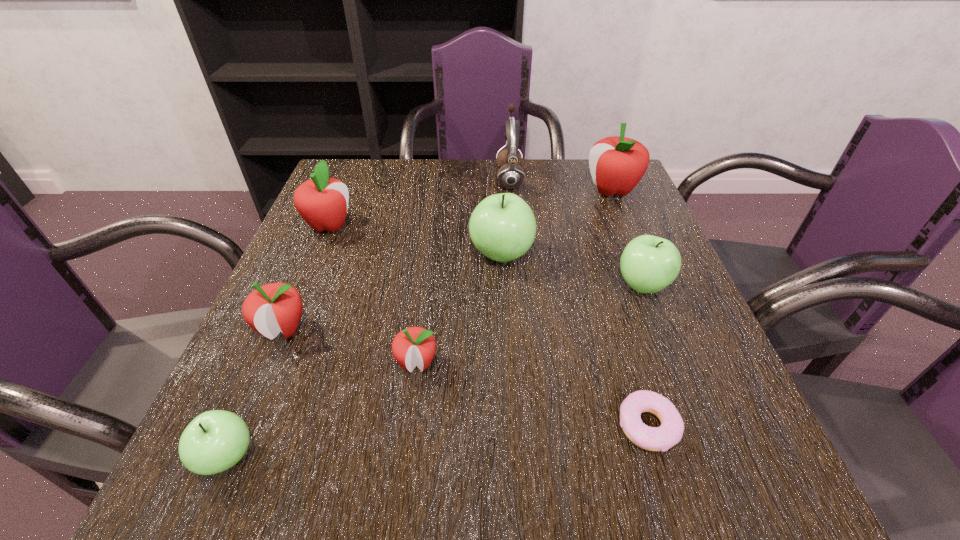
What are the coordinates of `free region located on the back of the second biggest green apple` in the screenshot? It's located at (610, 200).

Where is `blank space located 0.230m on the right of the second smallest red apple`? The height and width of the screenshot is (540, 960). blank space located 0.230m on the right of the second smallest red apple is located at coordinates (432, 329).

You are a GUI agent. You are given a task and a screenshot of the screen. Output one action in this format:
    pyautogui.click(x=<x>, y=<y>)
    Task: Click on the vacant space situated on the right of the third red apple from left to right
    
    Given the screenshot: What is the action you would take?
    tap(615, 363)

Image resolution: width=960 pixels, height=540 pixels. I want to click on free space located on the right of the nearest green apple, so click(468, 457).

Where is `vacant space located on the left of the doughnut`? vacant space located on the left of the doughnut is located at coordinates (392, 426).

At what (x,y) coordinates should I click in order to perform the action: click on earphone that is positioned at the far edge. Please return your answer as a coordinate pair (x, y). The width and height of the screenshot is (960, 540). Looking at the image, I should click on (510, 175).

The image size is (960, 540). I want to click on apple that is at the far edge, so click(x=617, y=164).

This screenshot has height=540, width=960. In order to click on apple that is at the near edge in this screenshot , I will do `click(214, 441)`.

Find the location of a particular element. This screenshot has width=960, height=540. doughnut that is at the near edge is located at coordinates (669, 433).

Locate an element on the screen. doughnut located in the right edge section of the desktop is located at coordinates (669, 433).